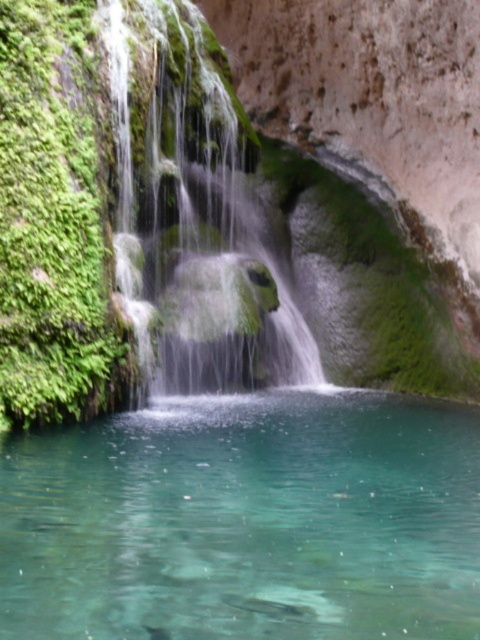
Question: Which point is closer to the camera?

Choices:
 (A) green mossy waterfall at center
 (B) clear glass water at center

Answer: (B)

Question: Can you confirm if clear glass water at center is positioned below green mossy waterfall at center?

Choices:
 (A) yes
 (B) no

Answer: (A)

Question: Is clear glass water at center wider than green mossy waterfall at center?

Choices:
 (A) yes
 (B) no

Answer: (A)

Question: In this image, where is clear glass water at center located relative to green mossy waterfall at center?

Choices:
 (A) right
 (B) left

Answer: (A)

Question: Which of the following is the farthest from the observer?

Choices:
 (A) clear glass water at center
 (B) green mossy waterfall at center

Answer: (B)